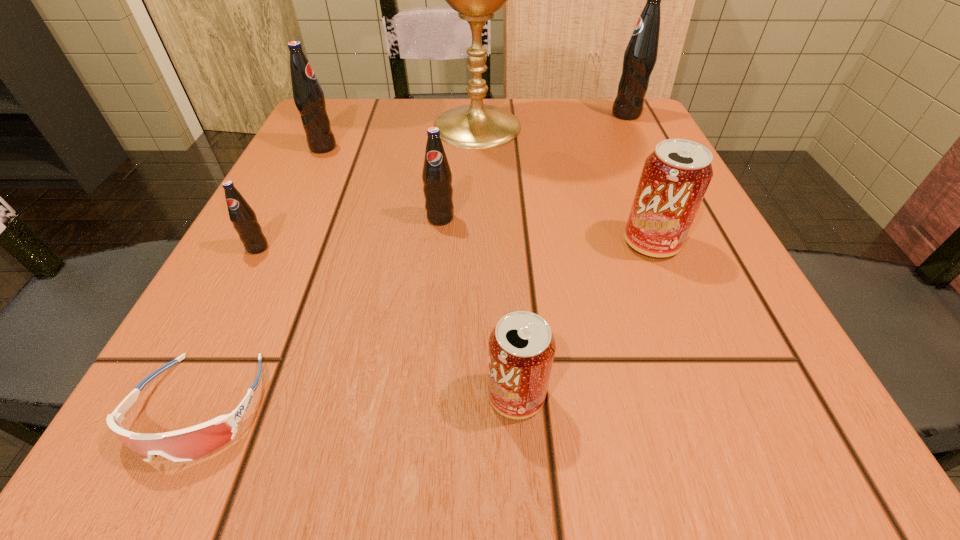
Locate an element on the screen. vacant space that satisfies the following two spatial constraints: 1. on the front label of the rightmost black pop; 2. on the front-facing side of the goggles is located at coordinates (772, 407).

You are a GUI agent. You are given a task and a screenshot of the screen. Output one action in this format:
    pyautogui.click(x=<x>, y=<y>)
    Task: Click on the vacant region that satisfies the following two spatial constraints: 1. on the front label of the farthest black pop; 2. on the front label of the second smallest black pop
    The height and width of the screenshot is (540, 960).
    Given the screenshot: What is the action you would take?
    pyautogui.click(x=678, y=218)

The width and height of the screenshot is (960, 540). I want to click on free space in the image that satisfies the following two spatial constraints: 1. on the front label of the biggest black pop; 2. on the front label of the third black pop from left to right, so click(678, 218).

Locate an element on the screen. The image size is (960, 540). vacant space that satisfies the following two spatial constraints: 1. on the front label of the nearer red soda can; 2. on the right side of the second farthest soda can is located at coordinates (204, 395).

Where is `free space that satisfies the following two spatial constraints: 1. on the front label of the rightmost black pop; 2. on the front-facing side of the red goggles`? free space that satisfies the following two spatial constraints: 1. on the front label of the rightmost black pop; 2. on the front-facing side of the red goggles is located at coordinates (772, 407).